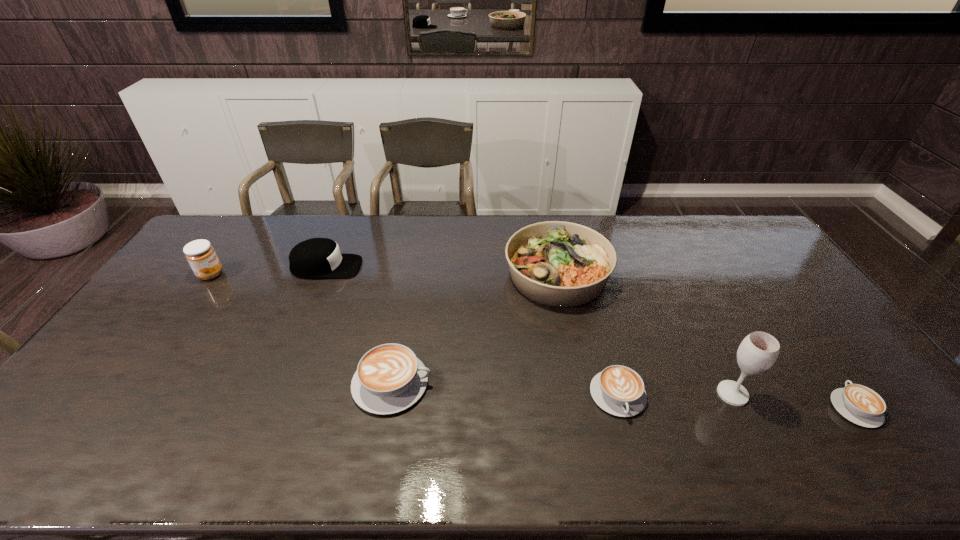
Locate an element on the screen. object that stands as the closest to the salad plate is located at coordinates (618, 390).

Identify which cappuccino is the third closest to the second object from left to right. Please provide its 2D coordinates. Your answer should be formatted as a tuple, i.e. [(x, y)], where the tuple contains the x and y coordinates of a point satisfying the conditions above.

[(859, 404)]

Where is `cappuccino that stands as the second closest to the jam`? cappuccino that stands as the second closest to the jam is located at coordinates (618, 390).

In order to click on free region that satisfies the following two spatial constraints: 1. on the side of the rightmost object with the handle; 2. on the front label of the jam in this screenshot , I will do `click(758, 274)`.

At what (x,y) coordinates should I click in order to perform the action: click on free space that satisfies the following two spatial constraints: 1. on the front-facing side of the cap; 2. on the right side of the salad plate. Please return your answer as a coordinate pair (x, y). Image resolution: width=960 pixels, height=540 pixels. Looking at the image, I should click on (324, 274).

Find the location of `vacant space that satisfies the following two spatial constraints: 1. on the front-facing side of the tallest object; 2. on the right side of the sixth object from right to left`. vacant space that satisfies the following two spatial constraints: 1. on the front-facing side of the tallest object; 2. on the right side of the sixth object from right to left is located at coordinates (275, 394).

Locate an element on the screen. free space in the image that satisfies the following two spatial constraints: 1. on the front-facing side of the second object from right to left; 2. on the left side of the cap is located at coordinates click(x=275, y=394).

Locate an element on the screen. Image resolution: width=960 pixels, height=540 pixels. vacant space that satisfies the following two spatial constraints: 1. on the front-facing side of the second object from right to left; 2. on the left side of the second object from left to right is located at coordinates (275, 394).